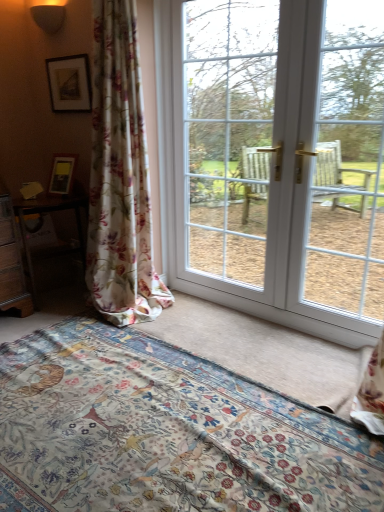
Question: Is white glass window at center, the 1th window screen from the left, taller than matte black picture frame at upper left?

Choices:
 (A) no
 (B) yes

Answer: (B)

Question: Is white glass window at center, the 1th window screen from the left, touching matte black picture frame at upper left?

Choices:
 (A) no
 (B) yes

Answer: (A)

Question: Considering the relative positions of white glass window at center, the 1th window screen from the left, and matte black picture frame at upper left in the image provided, is white glass window at center, the 1th window screen from the left, to the right of matte black picture frame at upper left from the viewer's perspective?

Choices:
 (A) yes
 (B) no

Answer: (A)

Question: From the image's perspective, does white glass window at center, the 1th window screen from the left, appear lower than matte black picture frame at upper left?

Choices:
 (A) no
 (B) yes

Answer: (B)

Question: Is white glass window at center, the 2th window screen when ordered from right to left, not inside matte black picture frame at upper left?

Choices:
 (A) yes
 (B) no

Answer: (A)

Question: From a real-world perspective, is white glossy door at center above or below clear glass door at right, the second window screen from the left?

Choices:
 (A) below
 (B) above

Answer: (B)

Question: Is white glossy door at center taller or shorter than clear glass door at right, the first window screen when ordered from right to left?

Choices:
 (A) short
 (B) tall

Answer: (B)

Question: Is white glossy door at center bigger or smaller than clear glass door at right, the second window screen from the left?

Choices:
 (A) big
 (B) small

Answer: (A)

Question: Is white glossy door at center to the left or to the right of clear glass door at right, the first window screen when ordered from right to left, in the image?

Choices:
 (A) right
 (B) left

Answer: (B)

Question: In terms of width, does white glass window at center, the 1th window screen from the left, look wider or thinner when compared to matte black sconce at upper left?

Choices:
 (A) thin
 (B) wide

Answer: (B)

Question: Is white glass window at center, the 1th window screen from the left, spatially inside matte black sconce at upper left, or outside of it?

Choices:
 (A) inside
 (B) outside

Answer: (B)

Question: Based on their sizes in the image, would you say white glass window at center, the 1th window screen from the left, is bigger or smaller than matte black sconce at upper left?

Choices:
 (A) big
 (B) small

Answer: (A)

Question: Considering the positions of white glass window at center, the 1th window screen from the left, and matte black sconce at upper left in the image, is white glass window at center, the 1th window screen from the left, taller or shorter than matte black sconce at upper left?

Choices:
 (A) short
 (B) tall

Answer: (B)

Question: From a real-world perspective, relative to white glass window at center, the 2th window screen when ordered from right to left, is floral fabric curtain at left vertically above or below?

Choices:
 (A) above
 (B) below

Answer: (B)

Question: Is point (92, 17) positioned closer to the camera than point (271, 97)?

Choices:
 (A) closer
 (B) farther

Answer: (B)